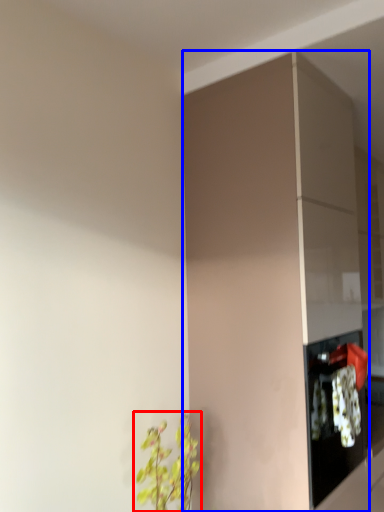
Question: Which point is closer to the camera, houseplant (highlighted by a red box) or cabinetry (highlighted by a blue box)?

Choices:
 (A) houseplant
 (B) cabinetry

Answer: (A)